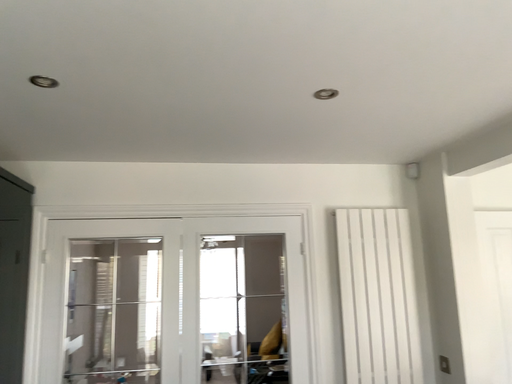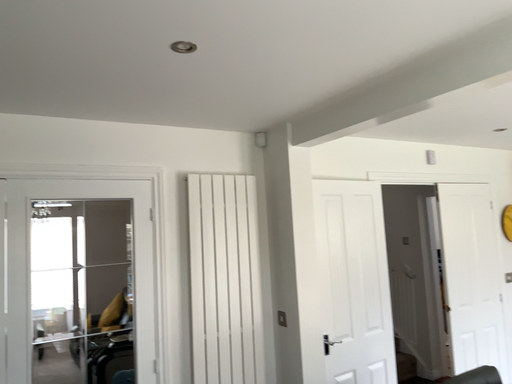
Question: Which way did the camera rotate in the video?

Choices:
 (A) rotated right
 (B) rotated left

Answer: (A)